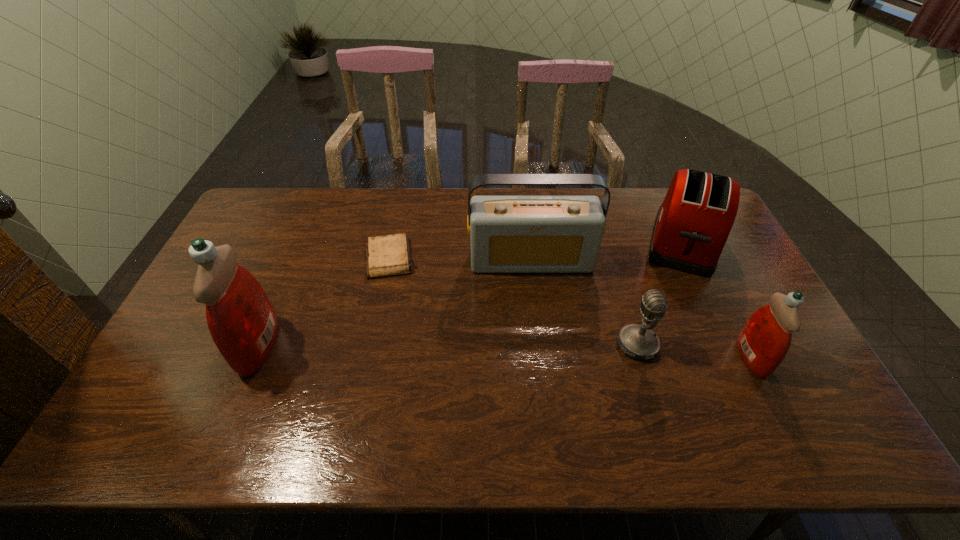
Find the location of a particular element. Image resolution: width=960 pixels, height=540 pixels. vacant space located 0.050m on the front surface of the leftmost object is located at coordinates (223, 346).

In order to click on blank space located 0.100m on the front surface of the leftmost object in this screenshot , I will do `click(204, 346)`.

Identify the location of vacant space located 0.180m on the front surface of the leftmost object. (175, 346).

Locate an element on the screen. The height and width of the screenshot is (540, 960). vacant space positioned on the front surface of the right detergent is located at coordinates (790, 357).

Image resolution: width=960 pixels, height=540 pixels. Identify the location of blank space located 0.360m on the front-facing side of the fourth object from right to left. (544, 375).

Locate an element on the screen. Image resolution: width=960 pixels, height=540 pixels. free point located 0.160m on the front of the toaster is located at coordinates click(721, 320).

Image resolution: width=960 pixels, height=540 pixels. In order to click on vacant space located 0.260m on the front-facing side of the fourth object from left to right in this screenshot , I will do `click(521, 345)`.

Identify the location of blank space located on the front-facing side of the fourth object from left to right. The image size is (960, 540). (594, 345).

At what (x,y) coordinates should I click in order to perform the action: click on free space located on the front-facing side of the fourth object from left to right. Please return your answer as a coordinate pair (x, y). Looking at the image, I should click on (580, 345).

At what (x,y) coordinates should I click in order to perform the action: click on vacant area situated on the left of the fifth object from right to left. Please return your answer as a coordinate pair (x, y). Looking at the image, I should click on (258, 258).